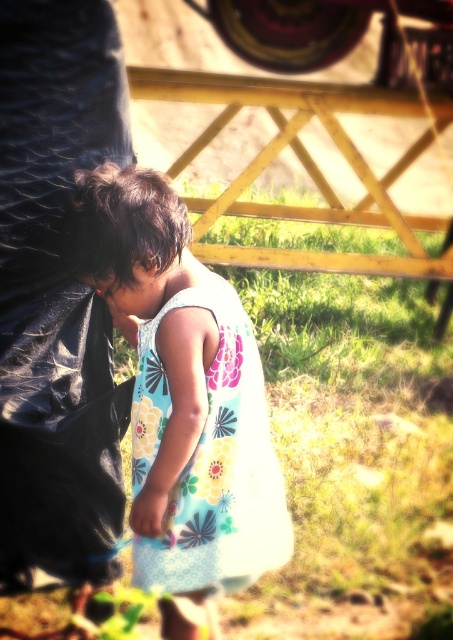
Does floral fabric dress at center have a lesser width compared to floral cotton dress at center?

Incorrect, floral fabric dress at center's width is not less than floral cotton dress at center's.

Does floral fabric dress at center have a larger size compared to floral cotton dress at center?

Yes.

Does point (174, 556) come in front of point (241, 396)?

That is True.

Locate an element on the screen. This screenshot has height=640, width=453. floral fabric dress at center is located at coordinates (183, 400).